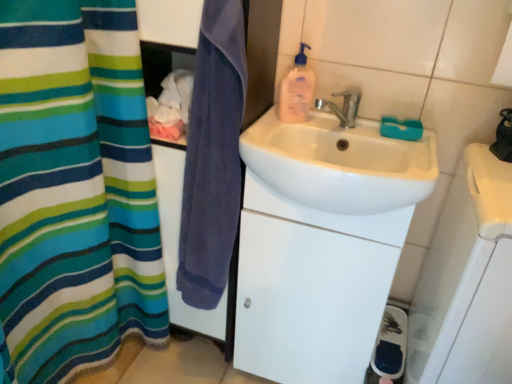
What do you see at coordinates (467, 281) in the screenshot?
I see `white plastic soap dish at right` at bounding box center [467, 281].

Where is `pink translucent liquid soap at upper center`? The height and width of the screenshot is (384, 512). pink translucent liquid soap at upper center is located at coordinates (297, 90).

The image size is (512, 384). Identify the location of purple cotton towel at center. (213, 156).

Measure the distance between point (196, 120) and camera.

Point (196, 120) and camera are 3.40 feet apart.

Describe the element at coordinates (343, 106) in the screenshot. I see `metallic silver faucet at upper center` at that location.

The height and width of the screenshot is (384, 512). Find the location of `white glossy cabinet at center`. white glossy cabinet at center is located at coordinates (311, 287).

Identify the location of white glossy sink at center. The width and height of the screenshot is (512, 384). (x=340, y=164).

At what (x,y) coordinates should I click in order to perform the action: click on white plastic soap dish at right. Please return your answer as a coordinate pair (x, y). The width and height of the screenshot is (512, 384). Looking at the image, I should click on (467, 281).

Considering the relative sizes of pink translucent liquid soap at upper center and metallic silver faucet at upper center in the image provided, is pink translucent liquid soap at upper center smaller than metallic silver faucet at upper center?

Actually, pink translucent liquid soap at upper center might be larger than metallic silver faucet at upper center.

You are a GUI agent. You are given a task and a screenshot of the screen. Output one action in this format:
    pyautogui.click(x=<x>, y=<y>)
    Task: Click on the cleaning product above the metallic silver faucet at upper center (from a real-world perspective)
    The height and width of the screenshot is (384, 512).
    Given the screenshot: What is the action you would take?
    pyautogui.click(x=297, y=90)

Considering the sizes of objects pink translucent liquid soap at upper center and metallic silver faucet at upper center in the image provided, who is shorter, pink translucent liquid soap at upper center or metallic silver faucet at upper center?

metallic silver faucet at upper center.

From the image's perspective, is pink translucent liquid soap at upper center over metallic silver faucet at upper center?

Yes, from the image's perspective, pink translucent liquid soap at upper center is above metallic silver faucet at upper center.

Between metallic silver faucet at upper center and white glossy sink at center, which one has more height?

white glossy sink at center.

The width and height of the screenshot is (512, 384). I want to click on tap above the white glossy sink at center (from the image's perspective), so click(x=343, y=106).

Is metallic silver faucet at upper center turned away from white glossy sink at center?

No, white glossy sink at center is not at the back of metallic silver faucet at upper center.

Can you confirm if purple cotton towel at center is positioned to the right of white glossy cabinet at center?

In fact, purple cotton towel at center is to the left of white glossy cabinet at center.

What's the angular difference between purple cotton towel at center and white glossy cabinet at center's facing directions?

0.366 degrees.

Which is further, (x=204, y=126) or (x=247, y=327)?

The point (x=247, y=327) is behind.

Which is correct: purple cotton towel at center is inside white glossy cabinet at center, or outside of it?

The correct answer is: outside.

From a real-world perspective, is white glossy sink at center above or below purple cotton towel at center?

white glossy sink at center is situated higher than purple cotton towel at center in the real world.

Is white glossy sink at center inside the boundaries of purple cotton towel at center, or outside?

white glossy sink at center is spatially situated outside purple cotton towel at center.

How much distance is there between white glossy sink at center and purple cotton towel at center?

They are 9.43 inches apart.

Is white glossy sink at center facing towards purple cotton towel at center?

No, white glossy sink at center is not facing towards purple cotton towel at center.

In the scene shown: Which point is more forward, (294, 119) or (349, 138)?

The point (349, 138) is in front.

Are pink translucent liquid soap at upper center and white glossy sink at center beside each other?

There is a gap between pink translucent liquid soap at upper center and white glossy sink at center.

Can you confirm if pink translucent liquid soap at upper center is wider than white glossy sink at center?

In fact, pink translucent liquid soap at upper center might be narrower than white glossy sink at center.

Does pink translucent liquid soap at upper center appear on the right side of white glossy sink at center?

Incorrect, pink translucent liquid soap at upper center is not on the right side of white glossy sink at center.

Is white glossy sink at center further to camera compared to white glossy cabinet at center?

That is False.

Between point (296, 158) and point (382, 255), which one is positioned in front?

The point (296, 158) is more forward.

How many degrees apart are the facing directions of white glossy sink at center and white glossy cabinet at center?

0.000549 degrees.

Who is taller, white glossy sink at center or white glossy cabinet at center?

Standing taller between the two is white glossy cabinet at center.

Can you confirm if metallic silver faucet at upper center is positioned to the left of purple cotton towel at center?

No.

Can you tell me how much metallic silver faucet at upper center and purple cotton towel at center differ in facing direction?

metallic silver faucet at upper center and purple cotton towel at center are facing 2.95 degrees away from each other.

Is metallic silver faucet at upper center behind purple cotton towel at center?

Yes, metallic silver faucet at upper center is further from the viewer.

This screenshot has width=512, height=384. Identify the location of tap on the right of the pink translucent liquid soap at upper center. (343, 106).

You are a GUI agent. You are given a task and a screenshot of the screen. Output one action in this format:
    pyautogui.click(x=<x>, y=<y>)
    Task: Click on the tap located above the white glossy sink at center (from the image's perspective)
    
    Given the screenshot: What is the action you would take?
    [x=343, y=106]

Estimate the real-world distances between objects in this image. Which object is further from metallic silver faucet at upper center, white glossy sink at center or white plastic soap dish at right?

white plastic soap dish at right lies further to metallic silver faucet at upper center than the other object.

Based on their spatial positions, is purple cotton towel at center or white glossy sink at center further from metallic silver faucet at upper center?

Among the two, purple cotton towel at center is located further to metallic silver faucet at upper center.

Looking at this image, considering their positions, is metallic silver faucet at upper center positioned further to white glossy cabinet at center than white glossy sink at center?

Among the two, metallic silver faucet at upper center is located further to white glossy cabinet at center.

Looking at the image, which one is located further to metallic silver faucet at upper center, pink translucent liquid soap at upper center or white plastic soap dish at right?

white plastic soap dish at right is positioned further to the anchor metallic silver faucet at upper center.

From the image, which object appears to be farther from pink translucent liquid soap at upper center, purple cotton towel at center or metallic silver faucet at upper center?

Based on the image, purple cotton towel at center appears to be further to pink translucent liquid soap at upper center.

Estimate the real-world distances between objects in this image. Which object is closer to metallic silver faucet at upper center, white plastic soap dish at right or white glossy sink at center?

The object closer to metallic silver faucet at upper center is white glossy sink at center.

Considering their positions, is white plastic soap dish at right positioned closer to pink translucent liquid soap at upper center than white glossy cabinet at center?

The object closer to pink translucent liquid soap at upper center is white glossy cabinet at center.

In the scene shown: Based on their spatial positions, is white plastic soap dish at right or white glossy cabinet at center further from metallic silver faucet at upper center?

white glossy cabinet at center lies further to metallic silver faucet at upper center than the other object.

Where is `bathroom cabinet between pink translucent liquid soap at upper center and white plastic soap dish at right from top to bottom`? bathroom cabinet between pink translucent liquid soap at upper center and white plastic soap dish at right from top to bottom is located at coordinates (311, 287).

Locate an element on the screen. bathroom cabinet between purple cotton towel at center and white glossy sink at center from left to right is located at coordinates (311, 287).

You are a GUI agent. You are given a task and a screenshot of the screen. Output one action in this format:
    pyautogui.click(x=<x>, y=<y>)
    Task: Click on the sink between pink translucent liquid soap at upper center and white glossy cabinet at center vertically
    The height and width of the screenshot is (384, 512).
    Given the screenshot: What is the action you would take?
    pyautogui.click(x=340, y=164)

Identify the location of cleaning product between purple cotton towel at center and white glossy sink at center in the horizontal direction. (297, 90).